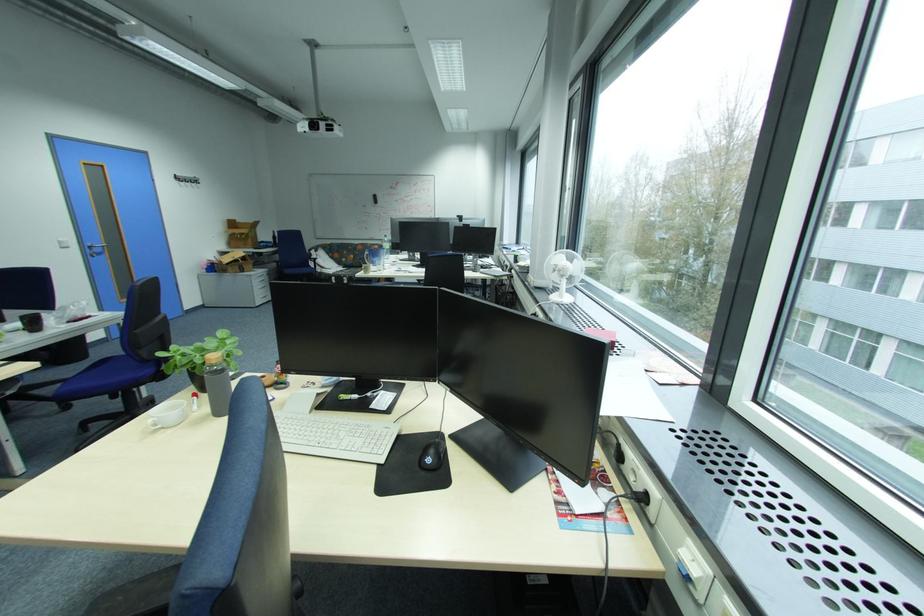
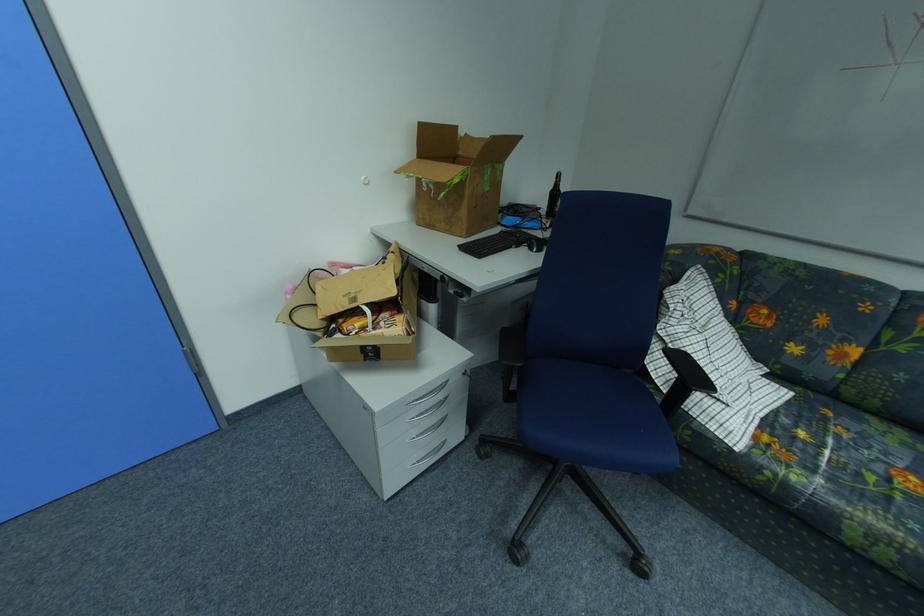
In the second image, find the point that corresponds to pixel 348 275 in the first image.

(804, 479)